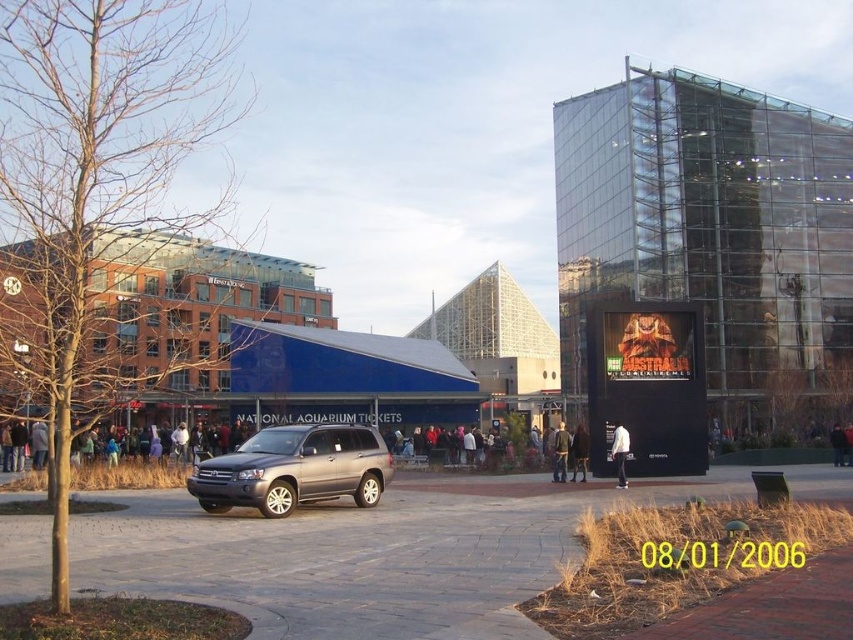
Is satin silver suv at center to the right of white matte jacket at center from the viewer's perspective?

Incorrect, satin silver suv at center is not on the right side of white matte jacket at center.

Who is higher up, satin silver suv at center or white matte jacket at center?

satin silver suv at center is higher up.

Which is behind, point (241, 502) or point (618, 470)?

The point (618, 470) is behind.

The height and width of the screenshot is (640, 853). I want to click on satin silver suv at center, so click(x=294, y=468).

At what (x,y) coordinates should I click in order to perform the action: click on blue glass building at center. Please return your answer as a coordinate pair (x, y). The height and width of the screenshot is (640, 853). Looking at the image, I should click on (178, 324).

Between blue glass building at center and white matte jacket at center, which one is positioned higher?

blue glass building at center

Identify the location of blue glass building at center. The width and height of the screenshot is (853, 640). (178, 324).

Image resolution: width=853 pixels, height=640 pixels. In order to click on blue glass building at center in this screenshot , I will do `click(178, 324)`.

Is glassy modern building at center thinner than dark gray jacket at center?

No, glassy modern building at center is not thinner than dark gray jacket at center.

The height and width of the screenshot is (640, 853). What do you see at coordinates (709, 227) in the screenshot?
I see `glassy modern building at center` at bounding box center [709, 227].

Is point (639, 193) positioned behind point (575, 442)?

Yes, it is.

In order to click on glassy modern building at center in this screenshot , I will do click(709, 227).